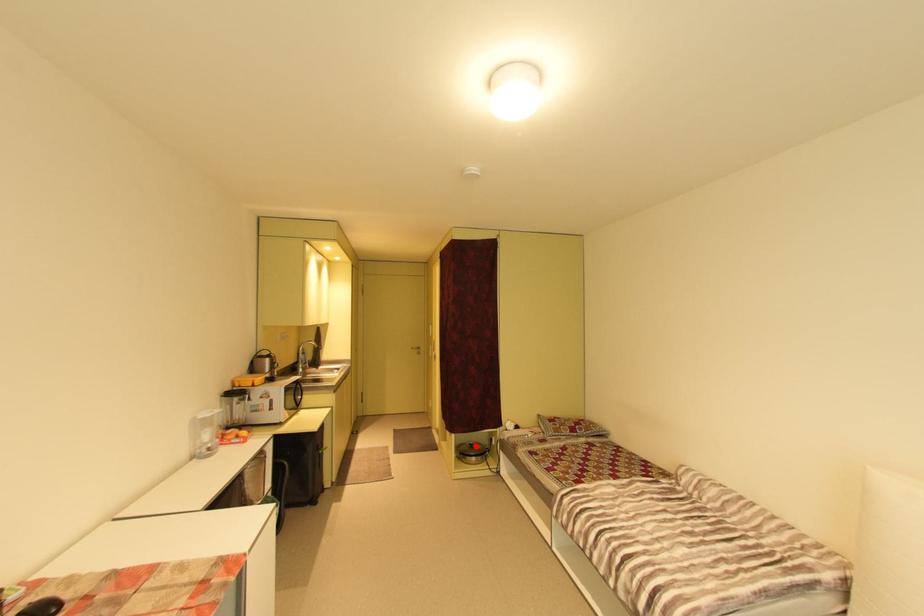
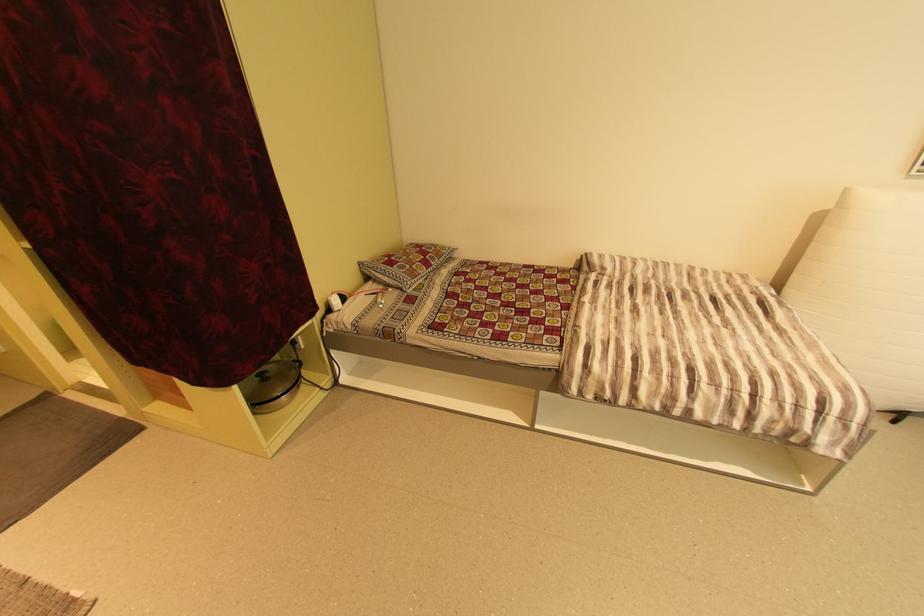
Find the pixel in the second image that matches the highlighted location in the first image.

(265, 379)